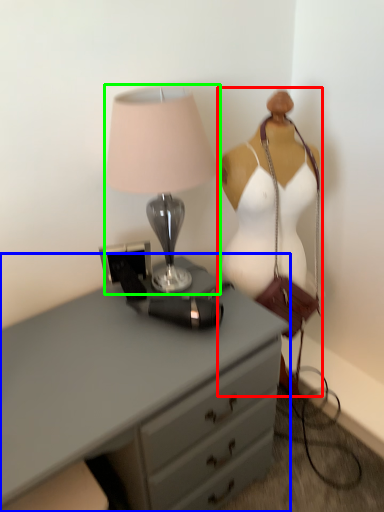
Question: Which is nearer to the mannequin (highlighted by a red box)? chest of drawers (highlighted by a blue box) or lamp (highlighted by a green box).

Choices:
 (A) chest of drawers
 (B) lamp

Answer: (B)